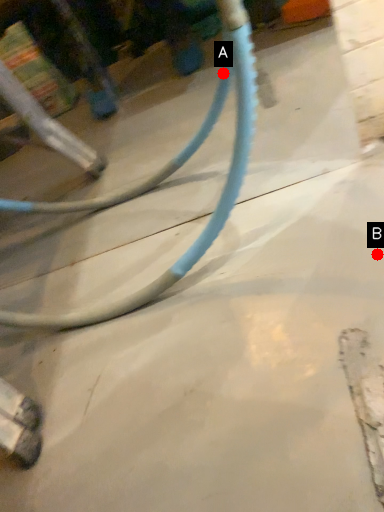
Question: Two points are circled on the image, labeled by A and B beside each circle. Which point is further to the camera?

Choices:
 (A) A is further
 (B) B is further

Answer: (A)